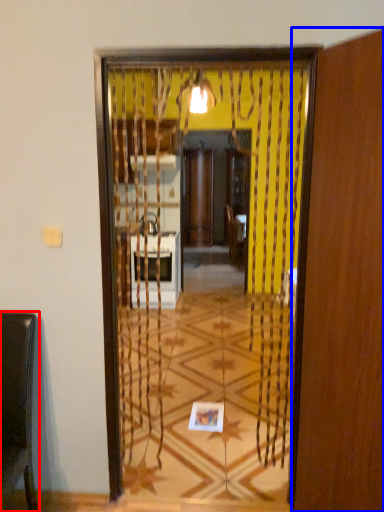
Question: Among these objects, which one is farthest to the camera, furniture (highlighted by a red box) or screen door (highlighted by a blue box)?

Choices:
 (A) furniture
 (B) screen door

Answer: (A)